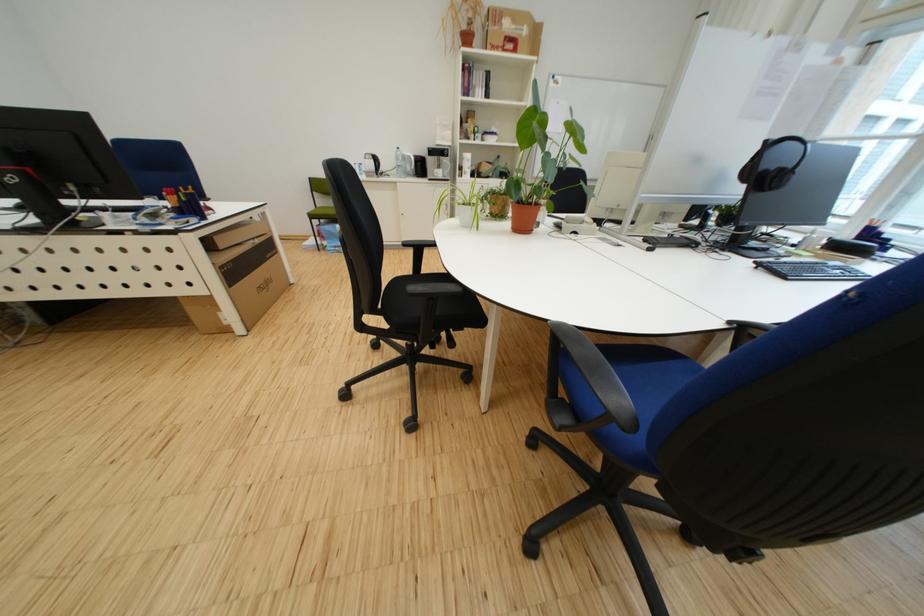
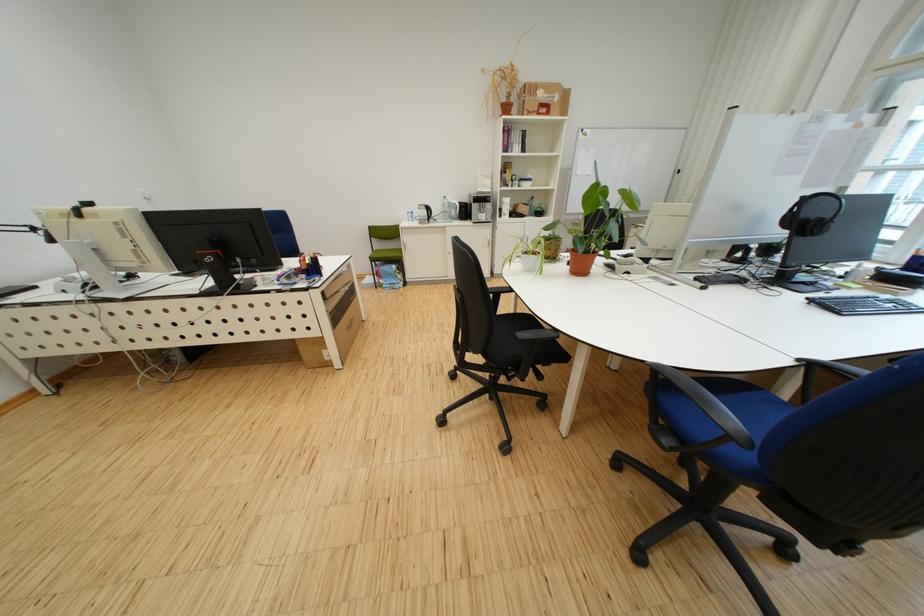
Find the pixel in the second image that matches point (658, 243) in the first image.

(708, 281)